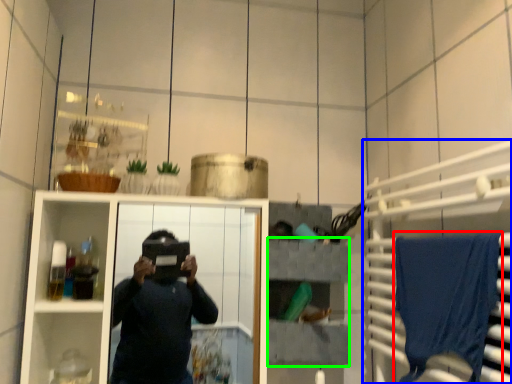
Question: Which is farther away from bath towel (highlighted by a red box)? cabinet (highlighted by a blue box) or shelf (highlighted by a green box)?

Choices:
 (A) cabinet
 (B) shelf

Answer: (B)